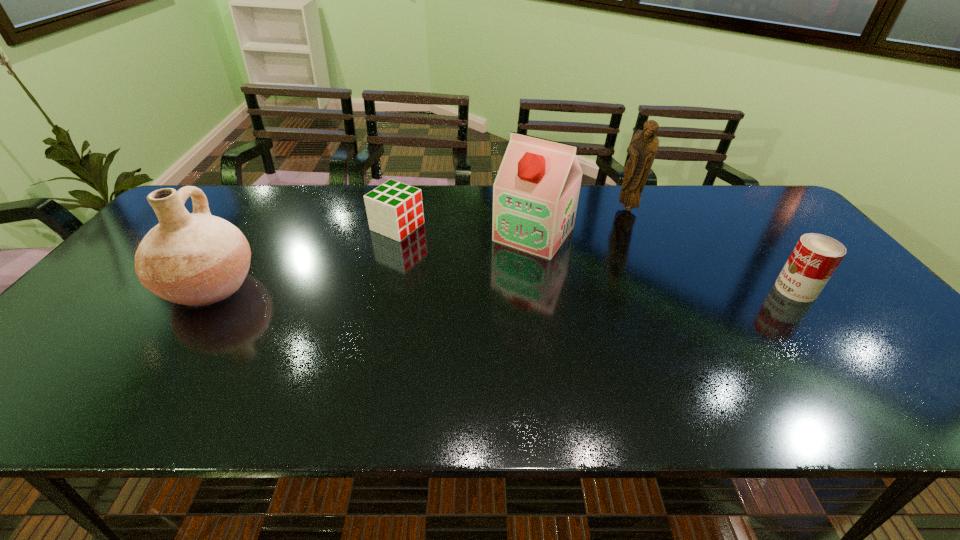
Identify the location of object that is the third closest to the second object from right to left. (394, 209).

Identify which object is located as the nearest to the can. Please provide its 2D coordinates. Your answer should be formatted as a tuple, i.e. [(x, y)], where the tuple contains the x and y coordinates of a point satisfying the conditions above.

[(643, 147)]

Where is `vacant position in the image that satisfies the following two spatial constraints: 1. on the front side of the fourth tallest object; 2. on the front label of the cube`? vacant position in the image that satisfies the following two spatial constraints: 1. on the front side of the fourth tallest object; 2. on the front label of the cube is located at coordinates (382, 289).